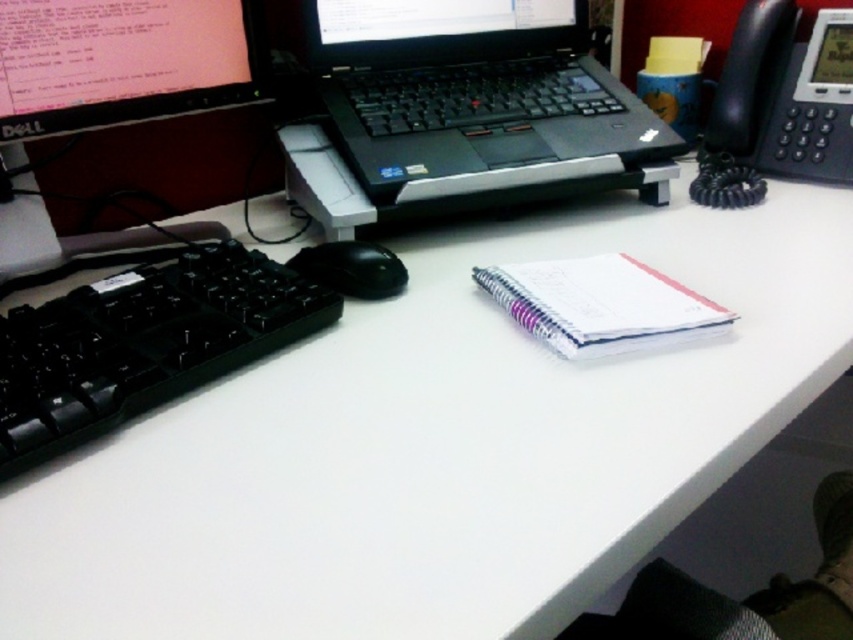
Question: Which of these objects is positioned farthest from the black plastic laptop at center?

Choices:
 (A) black plastic phone at upper right
 (B) black plastic monitor at upper left
 (C) black matte mouse at left

Answer: (C)

Question: Which object is positioned farthest from the black plastic keyboard at left?

Choices:
 (A) black plastic laptop at center
 (B) black matte mouse at left

Answer: (A)

Question: Can you confirm if black plastic phone at upper right is smaller than black matte mouse at left?

Choices:
 (A) no
 (B) yes

Answer: (A)

Question: Which of these objects is positioned farthest from the black plastic phone at upper right?

Choices:
 (A) black plastic keyboard at left
 (B) white paper notebook at center
 (C) black matte mouse at left
 (D) black plastic monitor at upper left

Answer: (A)

Question: Can you confirm if black plastic laptop at center is positioned to the left of black plastic monitor at upper left?

Choices:
 (A) no
 (B) yes

Answer: (A)

Question: Is black plastic laptop at center above black matte mouse at left?

Choices:
 (A) yes
 (B) no

Answer: (A)